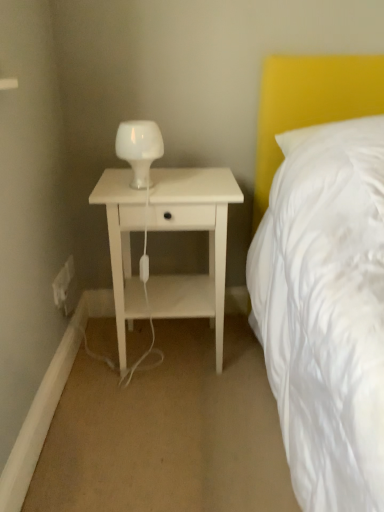
This screenshot has width=384, height=512. Identify the location of free location to the right of white glass lamp at center. (197, 186).